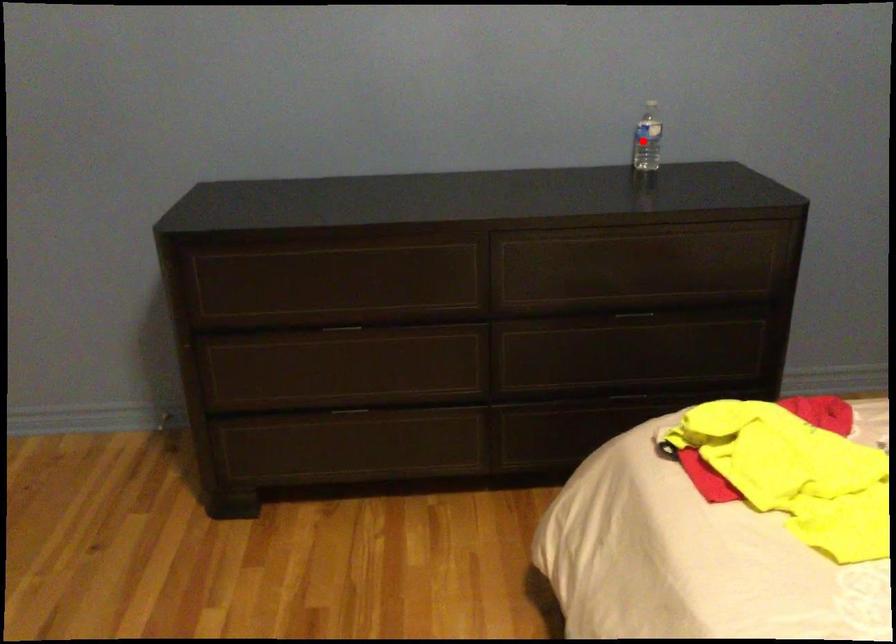
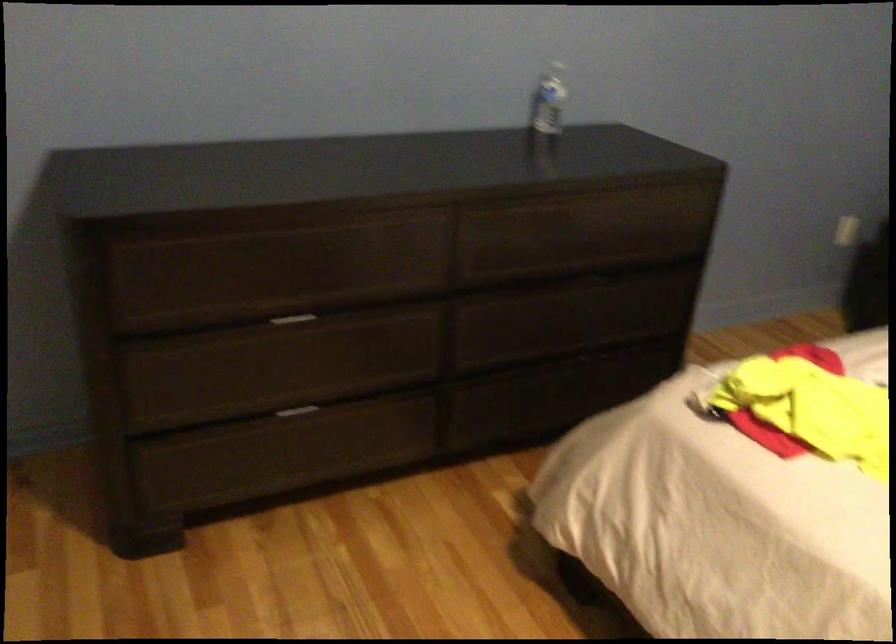
Where in the second image is the point corresponding to the highlighted location from the first image?

(548, 100)